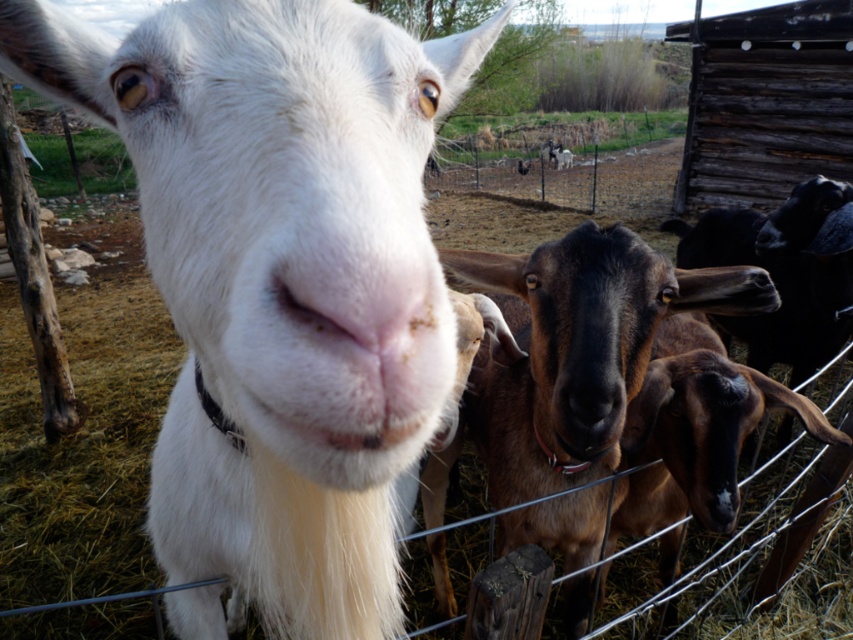
Is white woolen goat at center taller than brown furry goat at center?

Indeed, white woolen goat at center has a greater height compared to brown furry goat at center.

The width and height of the screenshot is (853, 640). Identify the location of white woolen goat at center. (280, 280).